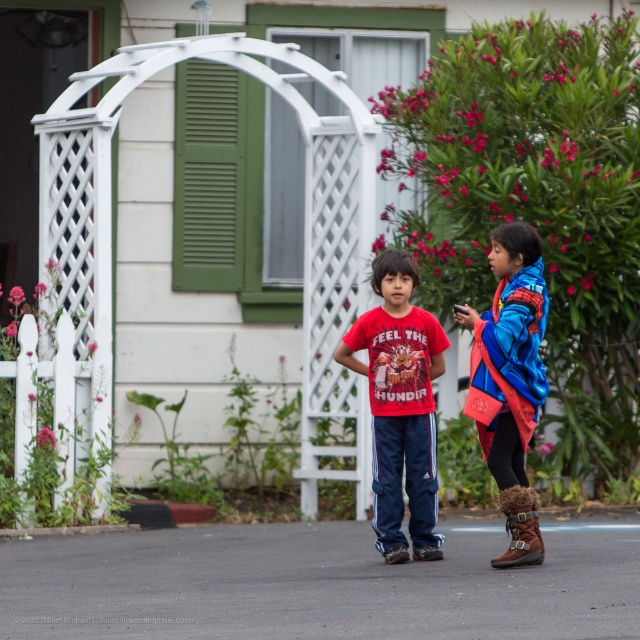
Question: Considering the real-world distances, which object is farthest from the blue fleece jacket at center?

Choices:
 (A) white lattice porch at center
 (B) green painted wood at center
 (C) matte red t-shirt at center

Answer: (B)

Question: Where is matte red t-shirt at center located in relation to blue fleece jacket at center in the image?

Choices:
 (A) right
 (B) left

Answer: (B)

Question: Which point appears closest to the camera in this image?

Choices:
 (A) (241, 182)
 (B) (481, 323)
 (C) (419, 316)

Answer: (B)

Question: Is white lattice porch at center below blue fleece jacket at center?

Choices:
 (A) yes
 (B) no

Answer: (B)

Question: Does white lattice porch at center have a larger size compared to matte red t-shirt at center?

Choices:
 (A) no
 (B) yes

Answer: (B)

Question: Which point is farther from the camera taking this photo?

Choices:
 (A) (356, 387)
 (B) (380, 282)

Answer: (A)